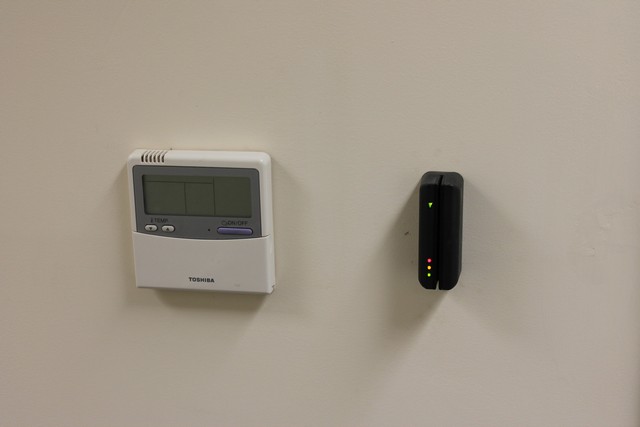
Where is `yellow light`? This screenshot has width=640, height=427. yellow light is located at coordinates (428, 270).